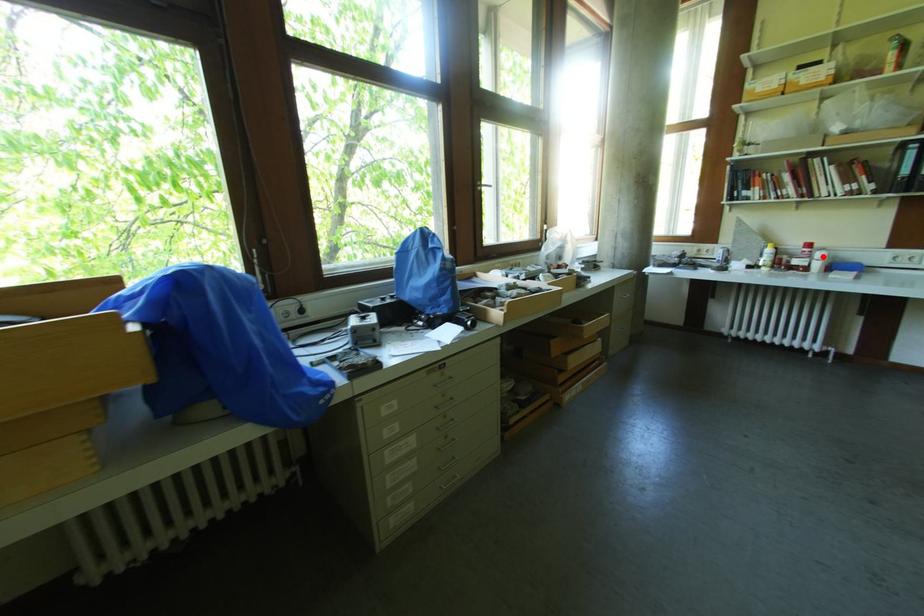
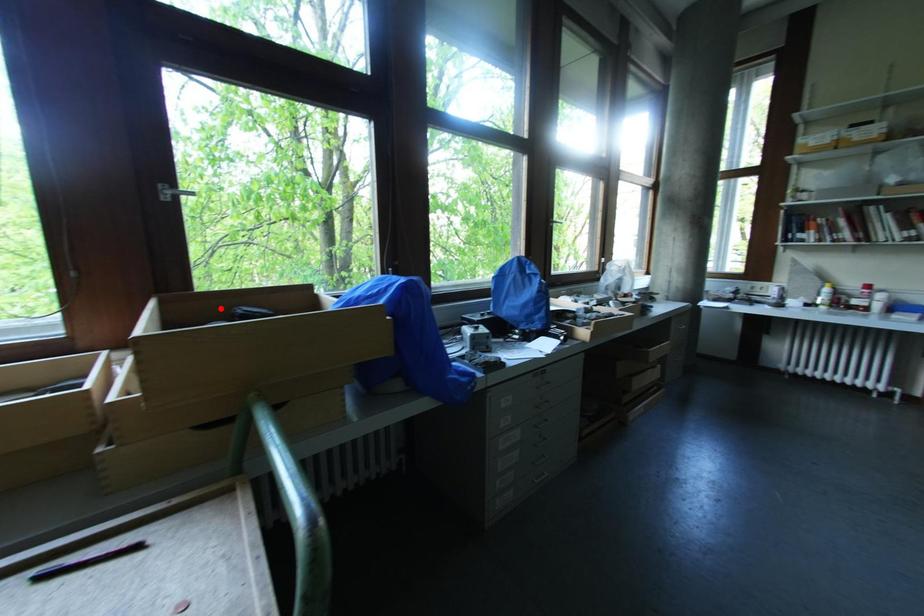
I am providing you with two images of the same scene from different viewpoints. A red point is marked on the first image and another point is marked on the second image. Does the point marked in image1 correspond to the same location as the one in image2?

No